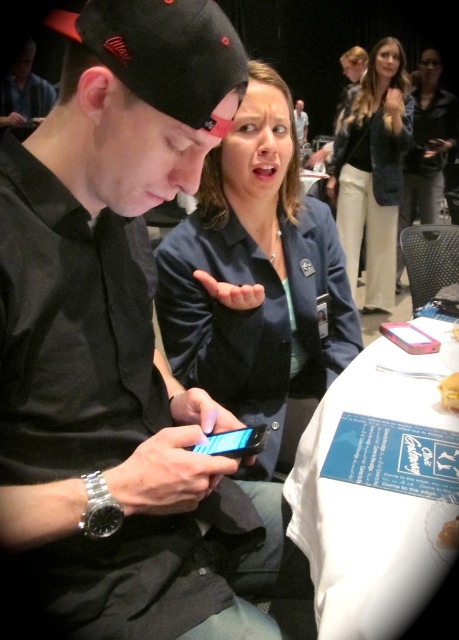
In the scene shown: Does black matte phone at center come behind blue fabric jacket at center?

No, it is in front of blue fabric jacket at center.

Is black matte phone at center closer to the viewer compared to blue fabric jacket at center?

Yes, it is in front of blue fabric jacket at center.

Which is in front, point (110, 397) or point (357, 337)?

Point (110, 397)

Where is `black matte phone at center`? black matte phone at center is located at coordinates (111, 332).

How far apart are dark blue blazer at upper right and matte black shirt at center?

2.76 meters

Who is more distant from viewer, (368, 160) or (296, 120)?

The point (368, 160) is behind.

Between point (360, 221) and point (296, 132), which one is positioned in front?

Point (296, 132) is in front.

You are a GUI agent. You are given a task and a screenshot of the screen. Output one action in this format:
    pyautogui.click(x=<x>, y=<y>)
    Task: Click on the dark blue blazer at upper right
    This screenshot has height=640, width=459.
    Given the screenshot: What is the action you would take?
    pyautogui.click(x=373, y=172)

Which is in front, point (121, 221) or point (296, 124)?

Positioned in front is point (121, 221).

Does black matte phone at center lie behind matte black shirt at center?

No, black matte phone at center is closer to the viewer.

At what (x,y) coordinates should I click in order to perform the action: click on black matte phone at center. Please return your answer as a coordinate pair (x, y). The height and width of the screenshot is (640, 459). Looking at the image, I should click on (111, 332).